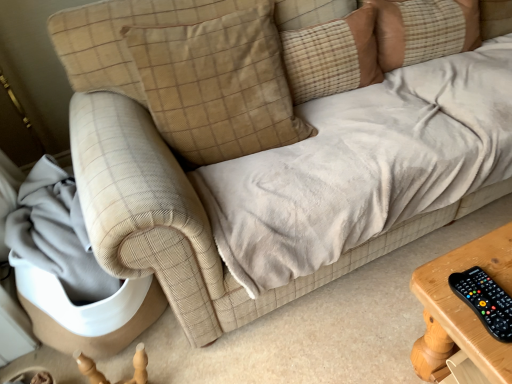
Question: Can you confirm if beige corduroy pillow at upper center, which is the 1th pillow in right-to-left order, is bigger than black plastic remote at lower right?

Choices:
 (A) yes
 (B) no

Answer: (A)

Question: Considering the relative sizes of beige corduroy pillow at upper center, which is the 1th pillow in right-to-left order, and black plastic remote at lower right in the image provided, is beige corduroy pillow at upper center, which is the 1th pillow in right-to-left order, wider than black plastic remote at lower right?

Choices:
 (A) yes
 (B) no

Answer: (A)

Question: Is beige corduroy pillow at upper center, the third pillow viewed from the left, next to black plastic remote at lower right and touching it?

Choices:
 (A) yes
 (B) no

Answer: (B)

Question: Is beige corduroy pillow at upper center, the third pillow viewed from the left, far away from black plastic remote at lower right?

Choices:
 (A) yes
 (B) no

Answer: (A)

Question: Could black plastic remote at lower right be considered to be inside beige corduroy pillow at upper center, which is the 1th pillow in right-to-left order?

Choices:
 (A) no
 (B) yes

Answer: (A)

Question: From a real-world perspective, is beige corduroy pillow at upper center, the third pillow viewed from the left, located higher than black plastic remote at lower right?

Choices:
 (A) no
 (B) yes

Answer: (B)

Question: From a real-world perspective, is beige corduroy pillow at upper center, the third pillow when ordered from right to left, on top of black plastic remote at lower right?

Choices:
 (A) no
 (B) yes

Answer: (B)

Question: Considering the relative sizes of beige corduroy pillow at upper center, the third pillow when ordered from right to left, and black plastic remote at lower right in the image provided, is beige corduroy pillow at upper center, the third pillow when ordered from right to left, shorter than black plastic remote at lower right?

Choices:
 (A) no
 (B) yes

Answer: (A)

Question: Could you tell me if beige corduroy pillow at upper center, marked as the first pillow in a left-to-right arrangement, is facing black plastic remote at lower right?

Choices:
 (A) no
 (B) yes

Answer: (B)

Question: Is beige corduroy pillow at upper center, marked as the first pillow in a left-to-right arrangement, bigger than black plastic remote at lower right?

Choices:
 (A) yes
 (B) no

Answer: (A)

Question: From the image's perspective, would you say beige corduroy pillow at upper center, marked as the first pillow in a left-to-right arrangement, is positioned over black plastic remote at lower right?

Choices:
 (A) no
 (B) yes

Answer: (B)

Question: Is beige corduroy pillow at upper center, the third pillow when ordered from right to left, at the right side of black plastic remote at lower right?

Choices:
 (A) yes
 (B) no

Answer: (B)

Question: Can you confirm if beige corduroy pillow at upper center, marked as the first pillow in a left-to-right arrangement, is shorter than brown plaid pillow at upper center, the second pillow from the right?

Choices:
 (A) no
 (B) yes

Answer: (A)